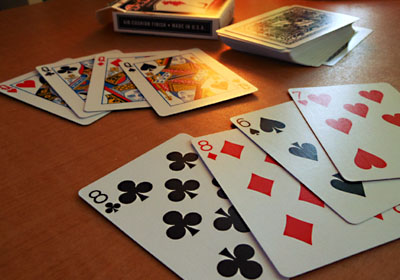
Locate an element on the screen. This screenshot has width=400, height=280. playing cards box is located at coordinates (170, 17).